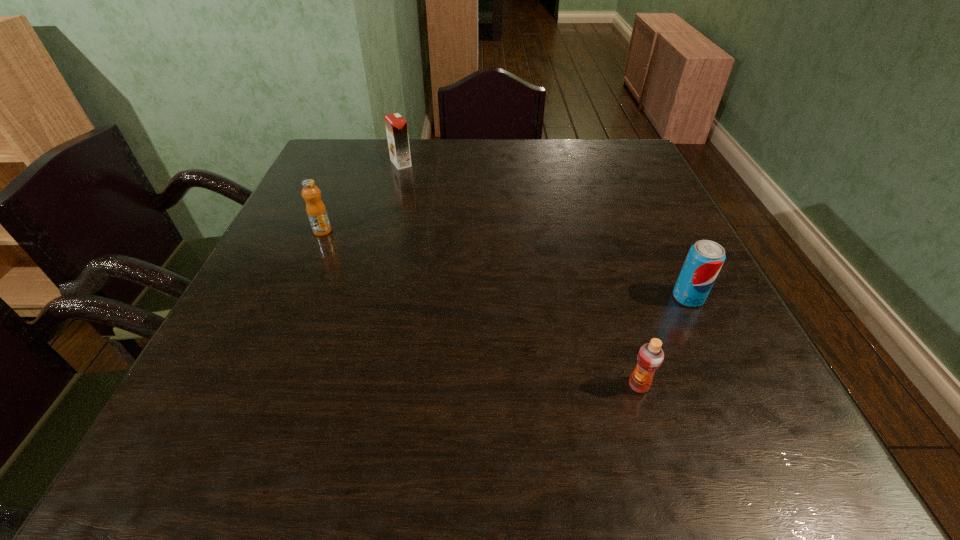
The height and width of the screenshot is (540, 960). I want to click on free space that is in between the leftmost object and the soda can, so click(505, 264).

Identify which object is located as the nearest to the second orange juice from right to left. Please provide its 2D coordinates. Your answer should be formatted as a tuple, i.e. [(x, y)], where the tuple contains the x and y coordinates of a point satisfying the conditions above.

[(316, 211)]

Identify which object is the second closest to the rightmost object. Please provide its 2D coordinates. Your answer should be formatted as a tuple, i.e. [(x, y)], where the tuple contains the x and y coordinates of a point satisfying the conditions above.

[(396, 126)]

Identify which orange juice is the second closest to the nearest orange juice. Please provide its 2D coordinates. Your answer should be formatted as a tuple, i.e. [(x, y)], where the tuple contains the x and y coordinates of a point satisfying the conditions above.

[(396, 126)]

Locate an element on the screen. Image resolution: width=960 pixels, height=540 pixels. orange juice that can be found as the second closest to the soda can is located at coordinates (396, 126).

You are a GUI agent. You are given a task and a screenshot of the screen. Output one action in this format:
    pyautogui.click(x=<x>, y=<y>)
    Task: Click on the vacant space that satisfies the following two spatial constraints: 1. on the front label of the second nearest object; 2. on the right side of the third nearest object
    This screenshot has width=960, height=540.
    Given the screenshot: What is the action you would take?
    pyautogui.click(x=294, y=298)

Where is `free point that satisfies the following two spatial constraints: 1. on the front label of the leftmost object; 2. on the left side of the soda can`? The height and width of the screenshot is (540, 960). free point that satisfies the following two spatial constraints: 1. on the front label of the leftmost object; 2. on the left side of the soda can is located at coordinates (294, 298).